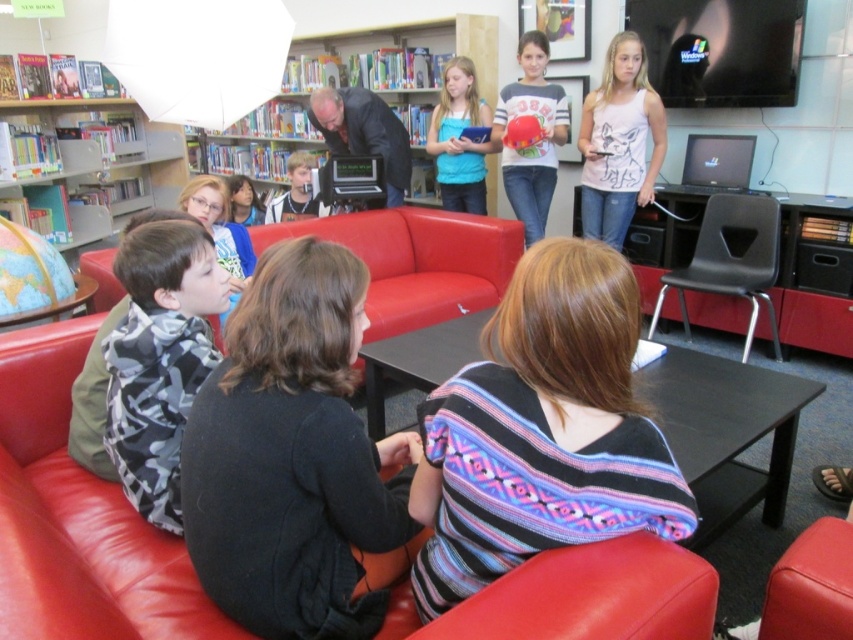
You are a photographer standing in the library scene. You need to take a photo of both the camouflage fabric shirt at left and the smooth black shirt at center. Which shirt will appear taller in the photo?

The smooth black shirt at center will appear taller in the photo because it is taller than the camouflage fabric shirt at left.